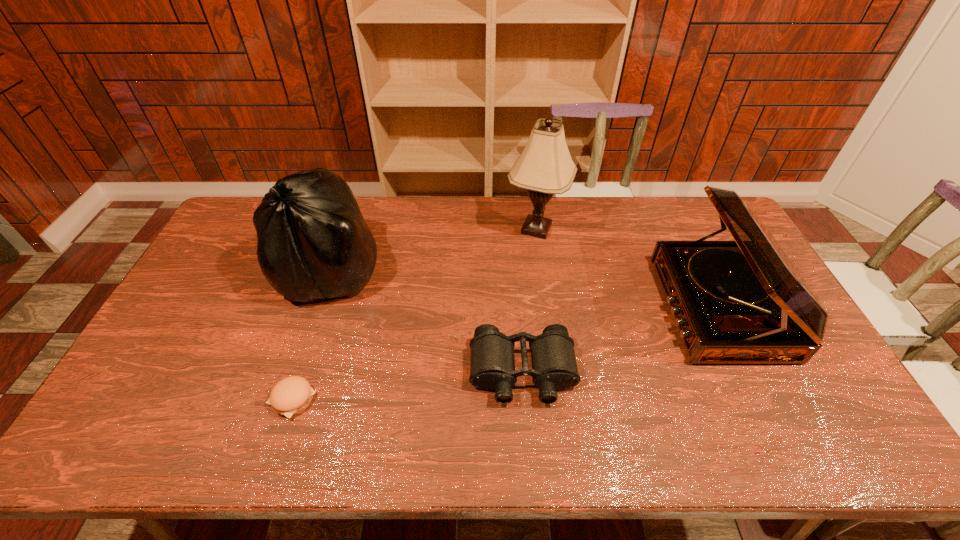
Where is `lamp`? The image size is (960, 540). lamp is located at coordinates (545, 167).

At what (x,y) coordinates should I click in order to perform the action: click on plastic bag. Please return your answer as a coordinate pair (x, y). Looking at the image, I should click on (313, 243).

At what (x,y) coordinates should I click in order to perform the action: click on the rightmost object. Please return your answer as a coordinate pair (x, y). This screenshot has width=960, height=540. Looking at the image, I should click on (735, 302).

The image size is (960, 540). I want to click on record player, so click(x=735, y=302).

Identify the location of the fourth tallest object. (492, 363).

The height and width of the screenshot is (540, 960). I want to click on the shortest object, so click(290, 396).

Where is `blank area located 0.170m on the front of the lamp`? blank area located 0.170m on the front of the lamp is located at coordinates (544, 288).

Locate an element on the screen. This screenshot has height=540, width=960. free region located 0.370m on the front of the plastic bag is located at coordinates (278, 430).

Identify the location of free space located 0.360m on the front-facing side of the rightmost object. (543, 308).

At what (x,y) coordinates should I click in order to perform the action: click on vacant space located on the front-facing side of the rightmost object. Please return your answer as a coordinate pair (x, y). Looking at the image, I should click on (530, 308).